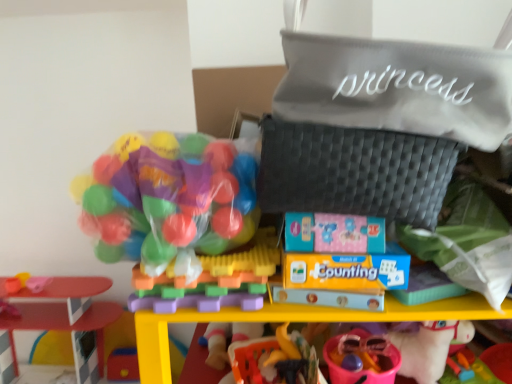
Question: Is smooth plastic table at left, acting as the fifth toy starting from the right, facing away from rubber duck at lower center, which appears as the second toy when viewed from the right?

Choices:
 (A) yes
 (B) no

Answer: (B)

Question: From a real-world perspective, is smooth plastic table at left, acting as the fifth toy starting from the right, physically below rubber duck at lower center, acting as the 4th toy starting from the left?

Choices:
 (A) no
 (B) yes

Answer: (B)

Question: Does smooth plastic table at left, which is counted as the first toy, starting from the left, have a greater height compared to rubber duck at lower center, acting as the 4th toy starting from the left?

Choices:
 (A) yes
 (B) no

Answer: (A)

Question: Does smooth plastic table at left, which is counted as the first toy, starting from the left, appear on the left side of rubber duck at lower center, acting as the 4th toy starting from the left?

Choices:
 (A) yes
 (B) no

Answer: (A)

Question: From the image's perspective, does smooth plastic table at left, which is counted as the first toy, starting from the left, appear lower than rubber duck at lower center, which appears as the second toy when viewed from the right?

Choices:
 (A) no
 (B) yes

Answer: (B)

Question: Is pink plastic bucket at lower center, the 1th toy viewed from the right, taller or shorter than translucent plastic balls at upper left, which ranks as the 2th toy in left-to-right order?

Choices:
 (A) tall
 (B) short

Answer: (B)

Question: Is pink plastic bucket at lower center, the 1th toy viewed from the right, bigger or smaller than translucent plastic balls at upper left, which ranks as the 2th toy in left-to-right order?

Choices:
 (A) big
 (B) small

Answer: (B)

Question: From a real-world perspective, is pink plastic bucket at lower center, the 5th toy viewed from the left, physically located above or below translucent plastic balls at upper left, which ranks as the 2th toy in left-to-right order?

Choices:
 (A) above
 (B) below

Answer: (B)

Question: Which is correct: pink plastic bucket at lower center, the 1th toy viewed from the right, is inside translucent plastic balls at upper left, which ranks as the 2th toy in left-to-right order, or outside of it?

Choices:
 (A) outside
 (B) inside

Answer: (A)

Question: From a real-world perspective, relative to pink plastic bucket at lower center, the 5th toy viewed from the left, is translucent plastic balls at center, the 3th toy positioned from the left, vertically above or below?

Choices:
 (A) above
 (B) below

Answer: (A)

Question: Do you think translucent plastic balls at center, acting as the third toy starting from the right, is within pink plastic bucket at lower center, the 1th toy viewed from the right, or outside of it?

Choices:
 (A) outside
 (B) inside

Answer: (A)

Question: Considering the positions of translucent plastic balls at center, the 3th toy positioned from the left, and pink plastic bucket at lower center, the 5th toy viewed from the left, in the image, is translucent plastic balls at center, the 3th toy positioned from the left, bigger or smaller than pink plastic bucket at lower center, the 5th toy viewed from the left,?

Choices:
 (A) big
 (B) small

Answer: (A)

Question: Considering the positions of point (201, 302) and point (355, 332), is point (201, 302) closer or farther from the camera than point (355, 332)?

Choices:
 (A) closer
 (B) farther

Answer: (A)

Question: Do you think translucent plastic balls at center, acting as the third toy starting from the right, is within rubber duck at lower center, which appears as the second toy when viewed from the right, or outside of it?

Choices:
 (A) inside
 (B) outside

Answer: (B)

Question: From the image's perspective, is translucent plastic balls at center, acting as the third toy starting from the right, above or below rubber duck at lower center, which appears as the second toy when viewed from the right?

Choices:
 (A) below
 (B) above

Answer: (B)